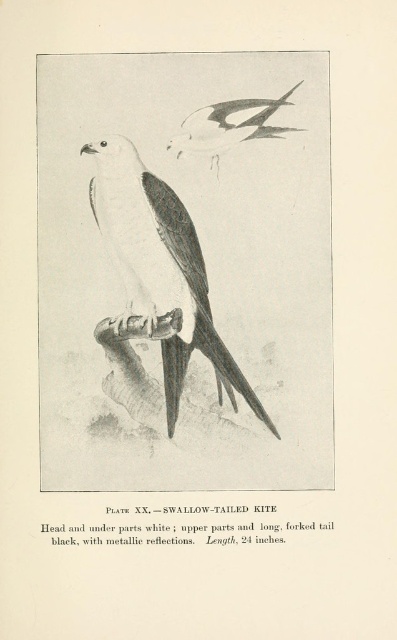
Question: Is white matte swallow-tailed kite at center smaller than white paper cutout of bird at upper center?

Choices:
 (A) yes
 (B) no

Answer: (B)

Question: Which of the following is the farthest from the observer?

Choices:
 (A) white matte swallow-tailed kite at center
 (B) white paper cutout of bird at upper center

Answer: (B)

Question: Does white matte swallow-tailed kite at center appear on the right side of white paper cutout of bird at upper center?

Choices:
 (A) no
 (B) yes

Answer: (A)

Question: Does white matte swallow-tailed kite at center have a greater width compared to white paper cutout of bird at upper center?

Choices:
 (A) no
 (B) yes

Answer: (B)

Question: Which point is farther to the camera?

Choices:
 (A) (183, 148)
 (B) (136, 168)

Answer: (A)